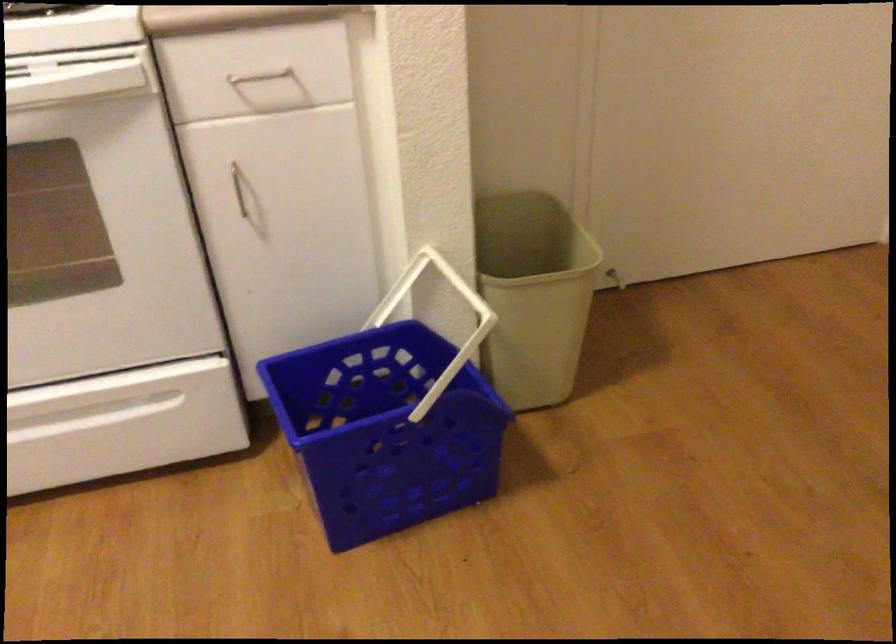
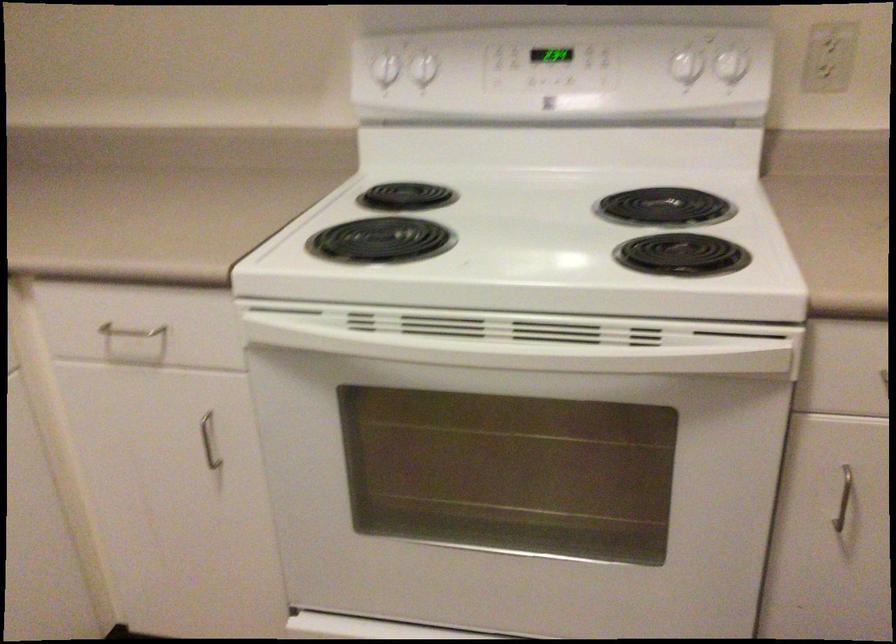
In the second image, find the point that corresponds to (252,196) in the first image.

(842, 498)